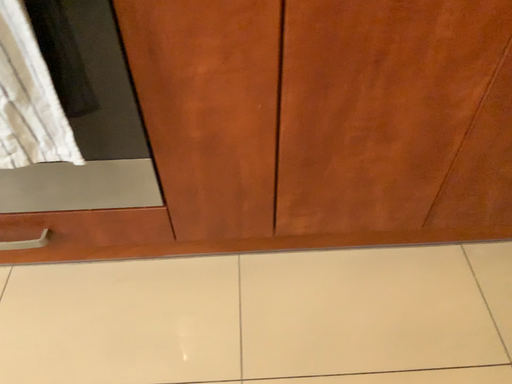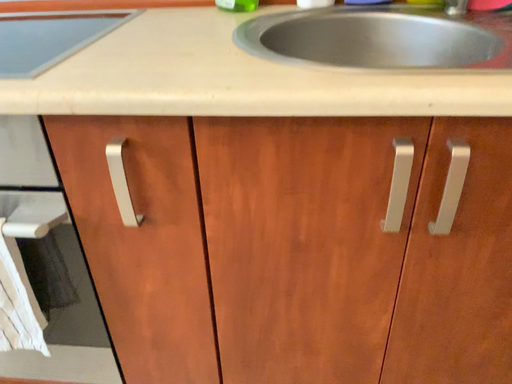
Question: How did the camera likely rotate when shooting the video?

Choices:
 (A) rotated right
 (B) rotated left

Answer: (B)